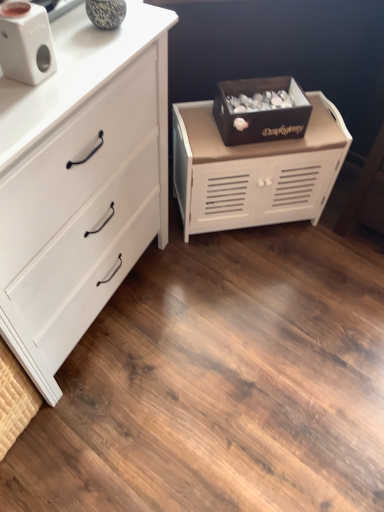
Question: From their relative heights in the image, would you say white matte chest of drawers at left, the first chest of drawers from the left, is taller or shorter than white matte cabinet at center, which is the first chest of drawers from right to left?

Choices:
 (A) tall
 (B) short

Answer: (A)

Question: Is white matte chest of drawers at left, arranged as the second chest of drawers when viewed from the right, wider or thinner than white matte cabinet at center, the 2th chest of drawers from the left?

Choices:
 (A) thin
 (B) wide

Answer: (B)

Question: Which object is positioned closest to the white matte cabinet at center, the 2th chest of drawers from the left?

Choices:
 (A) white matte speaker at upper left
 (B) white matte chest of drawers at left, the first chest of drawers from the left
 (C) dark brown wooden box at center

Answer: (C)

Question: Estimate the real-world distances between objects in this image. Which object is farther from the white matte cabinet at center, which is the first chest of drawers from right to left?

Choices:
 (A) dark brown wooden box at center
 (B) white matte chest of drawers at left, arranged as the second chest of drawers when viewed from the right
 (C) white matte speaker at upper left

Answer: (C)